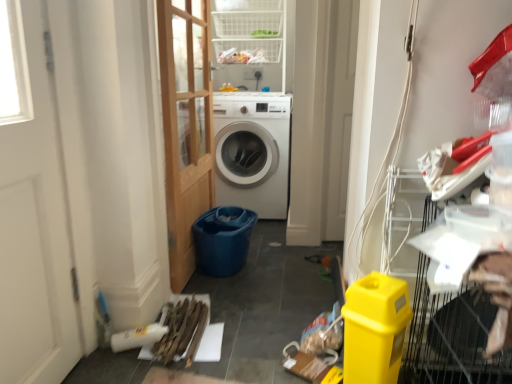
Question: Is the depth of white glossy washing machine at center less than that of blue plastic bucket at center?

Choices:
 (A) no
 (B) yes

Answer: (A)

Question: From a real-world perspective, is white glossy washing machine at center on blue plastic bucket at center?

Choices:
 (A) yes
 (B) no

Answer: (A)

Question: Is blue plastic bucket at center a part of white glossy washing machine at center?

Choices:
 (A) no
 (B) yes

Answer: (A)

Question: Does white glossy washing machine at center have a smaller size compared to blue plastic bucket at center?

Choices:
 (A) yes
 (B) no

Answer: (B)

Question: Is white glossy washing machine at center far from blue plastic bucket at center?

Choices:
 (A) no
 (B) yes

Answer: (A)

Question: Is white glossy washing machine at center beside blue plastic bucket at center?

Choices:
 (A) yes
 (B) no

Answer: (B)

Question: Would you say white glossy washing machine at center is part of white wood screen door at left's contents?

Choices:
 (A) no
 (B) yes

Answer: (A)

Question: Are white wood screen door at left and white glossy washing machine at center located far from each other?

Choices:
 (A) no
 (B) yes

Answer: (B)

Question: Is white wood screen door at left taller than white glossy washing machine at center?

Choices:
 (A) no
 (B) yes

Answer: (B)

Question: Can you confirm if white wood screen door at left is thinner than white glossy washing machine at center?

Choices:
 (A) no
 (B) yes

Answer: (B)

Question: From a real-world perspective, is white wood screen door at left physically below white glossy washing machine at center?

Choices:
 (A) no
 (B) yes

Answer: (A)

Question: Is white wood screen door at left facing away from white glossy washing machine at center?

Choices:
 (A) yes
 (B) no

Answer: (B)

Question: Is wooden planks at lower left aimed at yellow plastic bin at lower right?

Choices:
 (A) yes
 (B) no

Answer: (B)